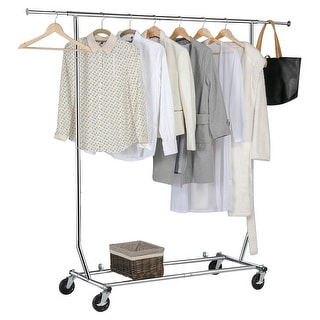
Identify the location of clothes hangers. The image size is (320, 320). (54, 27), (103, 29), (126, 32), (153, 28), (177, 32), (200, 33), (223, 33).